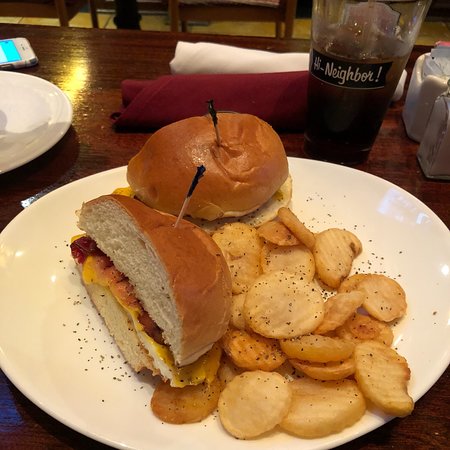
Locate an element on the screen. table is located at coordinates 104,49, 437,406, 32,434.